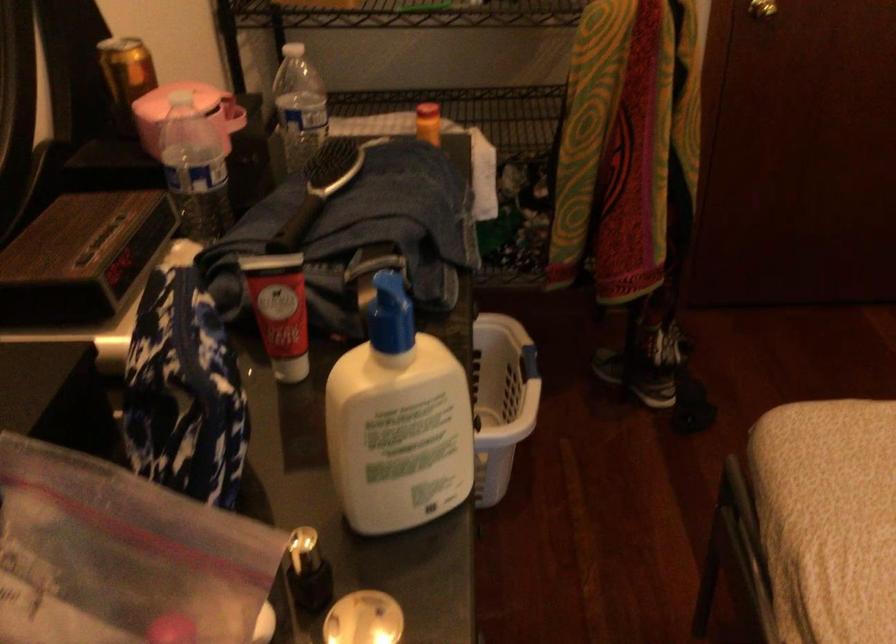
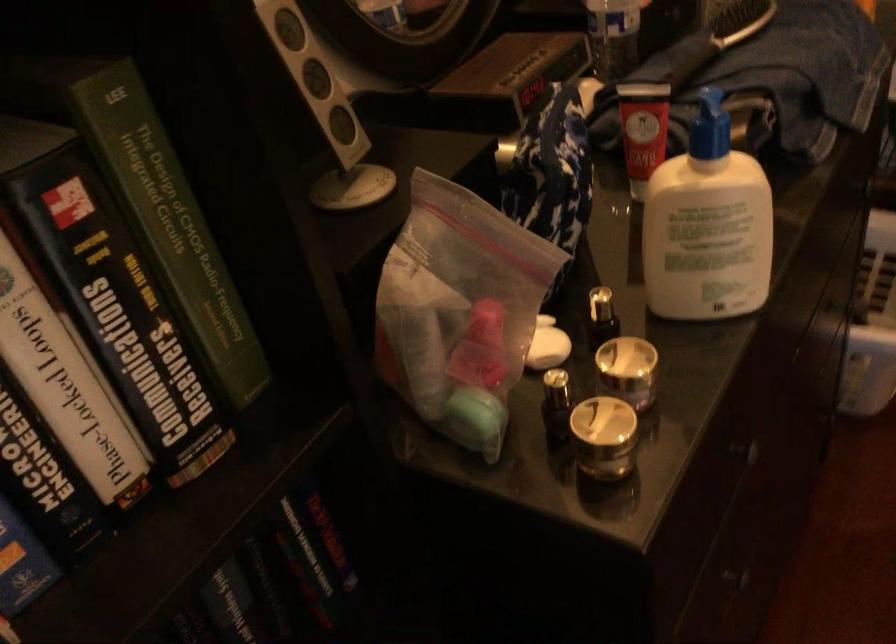
Locate, in the second image, the point that corresponds to [409,436] in the first image.

(707, 225)